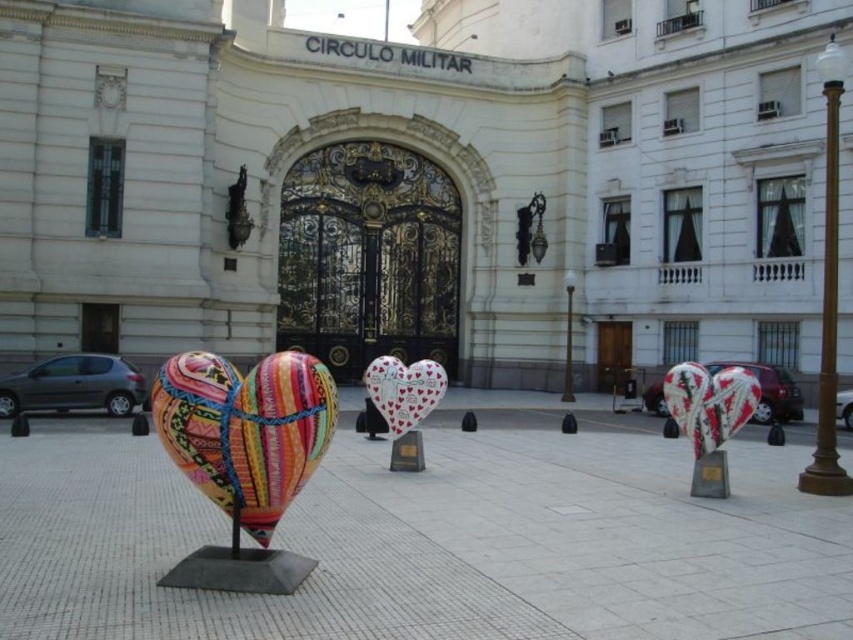
Question: Does textured fabric heart at center have a smaller size compared to polished bronze statue at upper left?

Choices:
 (A) yes
 (B) no

Answer: (B)

Question: Does brightly painted fabric heart at center come behind polished bronze statue at upper left?

Choices:
 (A) no
 (B) yes

Answer: (A)

Question: Considering the real-world distances, which object is closest to the white glossy heart at center?

Choices:
 (A) brightly painted fabric heart at center
 (B) textured fabric heart at center

Answer: (A)

Question: Among these objects, which one is nearest to the camera?

Choices:
 (A) white glossy heart at center
 (B) textured fabric heart at center

Answer: (B)

Question: Is brightly painted fabric heart at center wider than polished bronze statue at upper left?

Choices:
 (A) yes
 (B) no

Answer: (A)

Question: Which object appears closest to the camera in this image?

Choices:
 (A) textured fabric heart at center
 (B) polished bronze statue at upper left

Answer: (A)